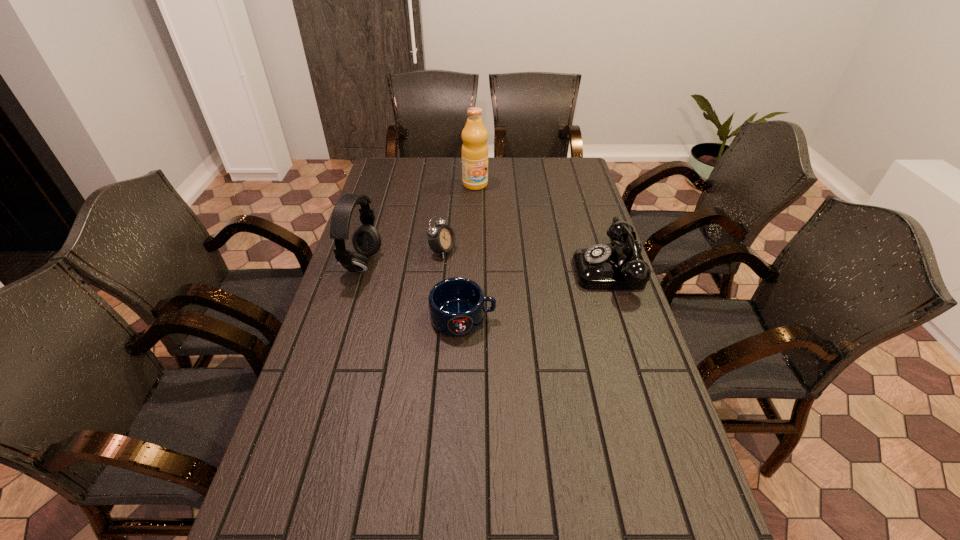
Identify the location of free spot between the fruit juice and the earphone. This screenshot has height=540, width=960. (419, 225).

This screenshot has height=540, width=960. I want to click on vacant space that's between the telephone and the shortest object, so click(538, 294).

Where is `vacant area that lies between the shortest object and the tallest object`? The height and width of the screenshot is (540, 960). vacant area that lies between the shortest object and the tallest object is located at coordinates (469, 251).

Where is `vacant region between the earphone and the farthest object`? The width and height of the screenshot is (960, 540). vacant region between the earphone and the farthest object is located at coordinates (419, 225).

This screenshot has height=540, width=960. I want to click on free space between the fourth shortest object and the shortest object, so click(413, 291).

You are a GUI agent. You are given a task and a screenshot of the screen. Output one action in this format:
    pyautogui.click(x=<x>, y=<y>)
    Task: Click on the unoccupied position between the farthest object and the shortest object
    
    Given the screenshot: What is the action you would take?
    pyautogui.click(x=469, y=251)

Where is `empty location between the telephone and the earphone`? Image resolution: width=960 pixels, height=540 pixels. empty location between the telephone and the earphone is located at coordinates (488, 267).

Where is `free space that is in between the tallest object and the earphone`? free space that is in between the tallest object and the earphone is located at coordinates (419, 225).

Identify the location of empty location between the shortest object and the rightmost object. (538, 294).

The image size is (960, 540). Identify the location of the second closest object relative to the alarm clock. (457, 305).